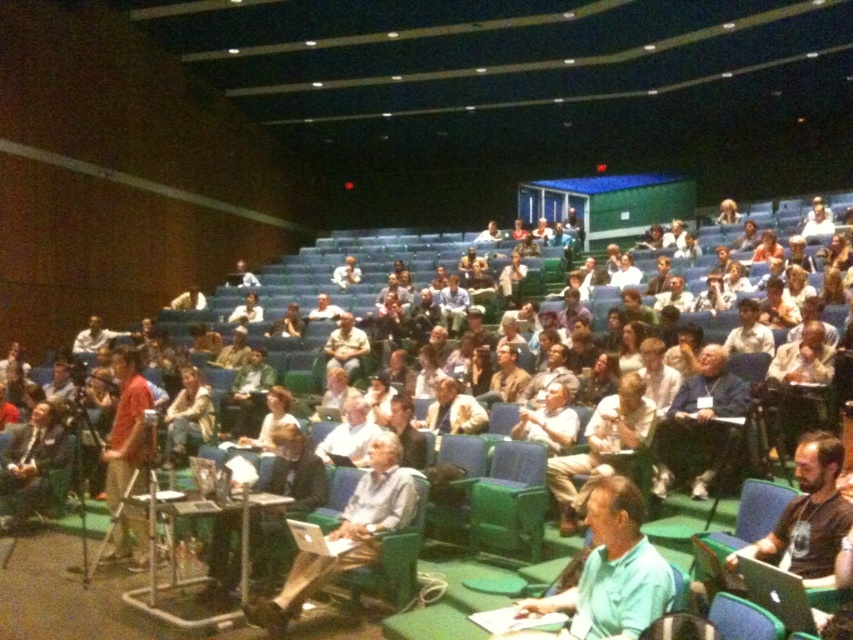
You are sitting in the front row of the auditorium and want to look at two points marked in the image. Which point, point [135,429] or point [12,472], is closer to you?

Point [135,429] is closer to the camera than point [12,472], so it is closer to you.

You are sitting in the front row of the auditorium and want to take a photo of both the point at coordinates (x=396, y=476) and the point at (x=339, y=280). Which point will appear larger in your photo?

Point at coordinates (x=396, y=476) will appear larger in the photo because it is closer to the camera than point at (x=339, y=280).

You are organizing a photo shoot in the auditorium and need to position two models so they can see each other clearly. The first model will wear the matte orange shirt at center, and the second will wear the light brown leather jacket at lower left. Given that each model requires 0.8 meters of personal space, will they be able to maintain this distance while facing each other?

The distance between the matte orange shirt at center and the light brown leather jacket at lower left is 1.60 meters. Since each model needs 0.8 meters of personal space, the total required distance is 0.8m x 2 equals 1.6 meters. The existing distance matches exactly, so they can maintain the required space while facing each other.